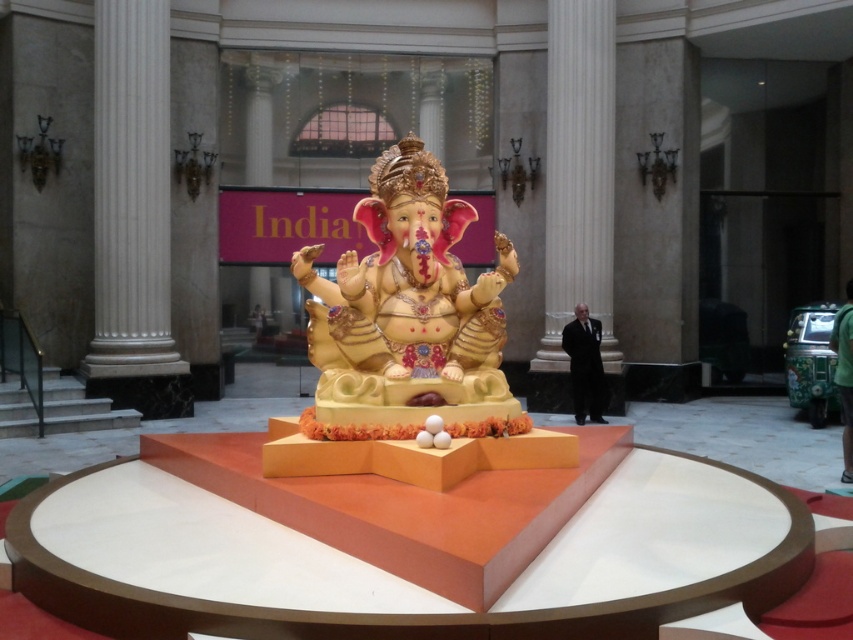
Question: Can you confirm if white marble column at left is positioned above white marble pillar at center?

Choices:
 (A) yes
 (B) no

Answer: (B)

Question: Which point is farther to the camera?

Choices:
 (A) gold/golden statue at center
 (B) white marble pillar at center
 (C) white marble column at left

Answer: (B)

Question: Is gold/golden statue at center thinner than white marble pillar at center?

Choices:
 (A) no
 (B) yes

Answer: (A)

Question: Which of the following is the farthest from the observer?

Choices:
 (A) (567, 168)
 (B) (119, 42)
 (C) (375, 339)

Answer: (A)

Question: Does white marble column at left appear on the left side of white marble pillar at center?

Choices:
 (A) yes
 (B) no

Answer: (A)

Question: Which point appears farthest from the camera in this image?

Choices:
 (A) (117, 304)
 (B) (537, 362)

Answer: (B)